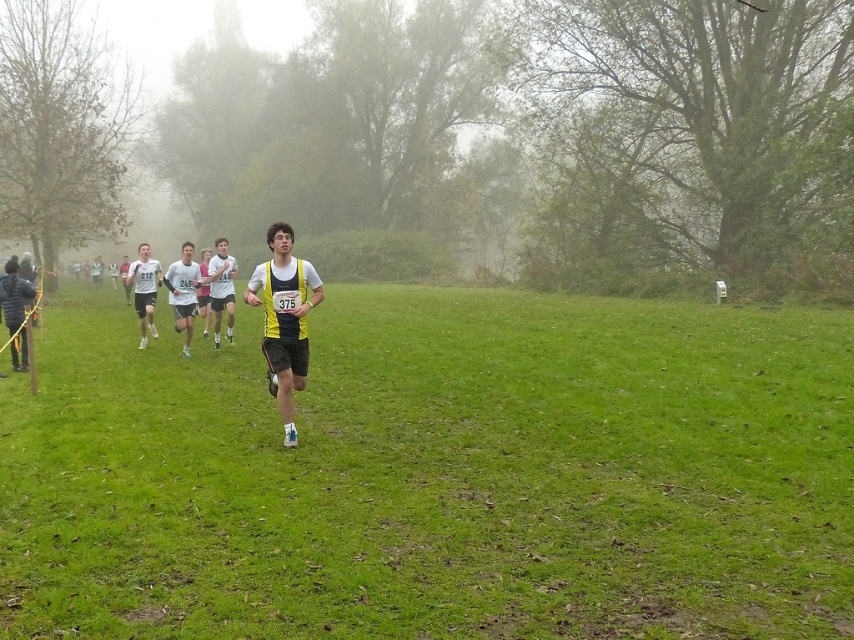
Question: Which point is closer to the camera?

Choices:
 (A) white matte shirt at left
 (B) white jersey at center
 (C) yellow/black athletic vest at center
 (D) white fabric shirt at center

Answer: (C)

Question: Which of the following is the farthest from the observer?

Choices:
 (A) yellow fabric runner at center
 (B) white jersey at center
 (C) yellow/black athletic vest at center
 (D) white matte shirt at left

Answer: (D)

Question: Can you confirm if yellow fabric runner at center is smaller than white fabric shirt at center?

Choices:
 (A) yes
 (B) no

Answer: (B)

Question: Does white fabric shirt at center appear on the left side of white jersey at center?

Choices:
 (A) no
 (B) yes

Answer: (B)

Question: Is yellow fabric runner at center closer to camera compared to white fabric shirt at center?

Choices:
 (A) no
 (B) yes

Answer: (B)

Question: Which of the following is the closest to the observer?

Choices:
 (A) white jersey at center
 (B) white fabric shirt at center
 (C) yellow/black athletic vest at center

Answer: (C)